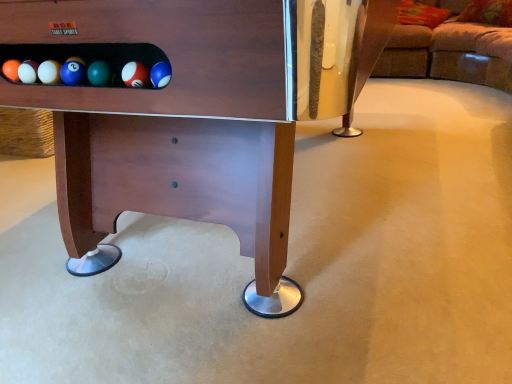
Question: Considering the positions of wooden pool table at center and brown fabric couch at upper right in the image, is wooden pool table at center bigger or smaller than brown fabric couch at upper right?

Choices:
 (A) small
 (B) big

Answer: (B)

Question: From a real-world perspective, relative to brown fabric couch at upper right, is wooden pool table at center vertically above or below?

Choices:
 (A) below
 (B) above

Answer: (B)

Question: Visually, is wooden pool table at center positioned to the left or to the right of brown fabric couch at upper right?

Choices:
 (A) left
 (B) right

Answer: (A)

Question: From a real-world perspective, is brown fabric couch at upper right positioned above or below wooden pool table at center?

Choices:
 (A) below
 (B) above

Answer: (A)

Question: Based on their sizes in the image, would you say brown fabric couch at upper right is bigger or smaller than wooden pool table at center?

Choices:
 (A) small
 (B) big

Answer: (A)

Question: In terms of width, does brown fabric couch at upper right look wider or thinner when compared to wooden pool table at center?

Choices:
 (A) thin
 (B) wide

Answer: (B)

Question: From their relative heights in the image, would you say brown fabric couch at upper right is taller or shorter than wooden pool table at center?

Choices:
 (A) short
 (B) tall

Answer: (A)